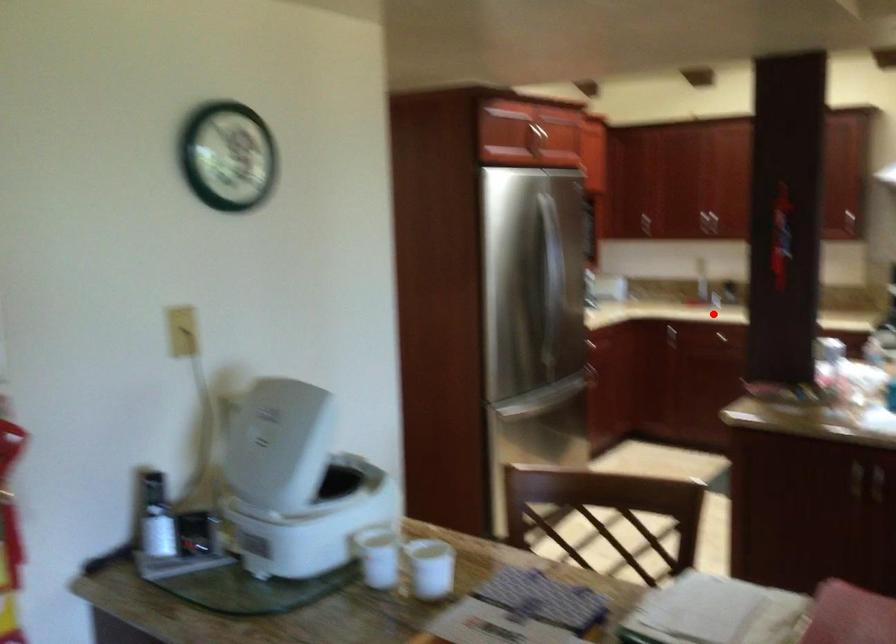
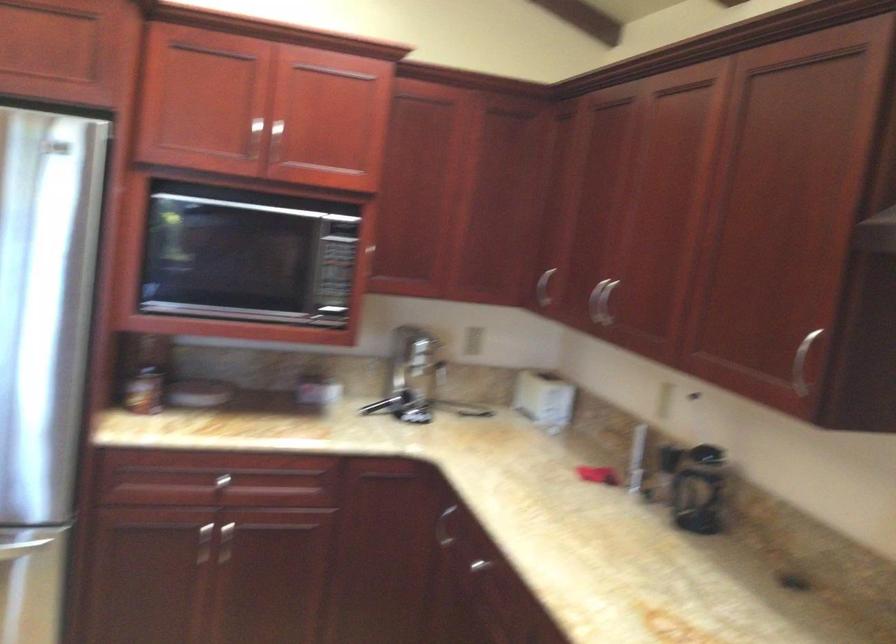
Question: I am providing you with two images of the same scene from different viewpoints. Image1 has a red point marked. In image2, the corresponding 3D location appears at what relative position? Reply with the corresponding letter.

Choices:
 (A) Closer
 (B) Farther

Answer: (A)